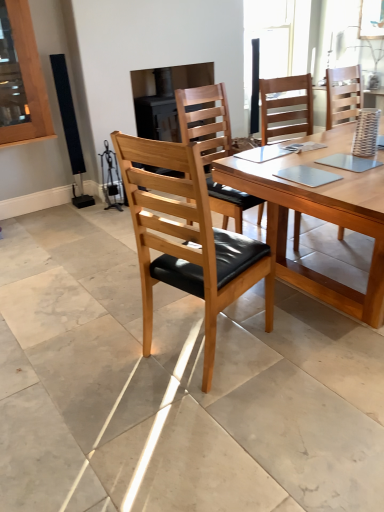
Question: From the image's perspective, relative to natural wood/black leather chair at center, the third chair in the right-to-left sequence, is light brown wood chair at center, the 1th chair in the right-to-left sequence, above or below?

Choices:
 (A) above
 (B) below

Answer: (A)

Question: In terms of size, does light brown wood chair at center, the 1th chair in the right-to-left sequence, appear bigger or smaller than natural wood/black leather chair at center, the third chair in the right-to-left sequence?

Choices:
 (A) small
 (B) big

Answer: (B)

Question: Estimate the real-world distances between objects in this image. Which object is farther from the light brown wood chair at center, the 1th chair in the right-to-left sequence?

Choices:
 (A) wooden table at center
 (B) transparent glass window at upper center
 (C) natural wood/black leather chair at center, the third chair in the right-to-left sequence
 (D) wooden chair with black cushion at center, the second chair viewed from the left

Answer: (B)

Question: Based on their relative distances, which object is farther from the transparent glass window at upper center?

Choices:
 (A) light brown wood chair at center, the 1th chair in the right-to-left sequence
 (B) natural wood/black leather chair at center, the first chair from the left
 (C) wooden table at center
 (D) wooden chair with black cushion at center, the second chair viewed from the left

Answer: (B)